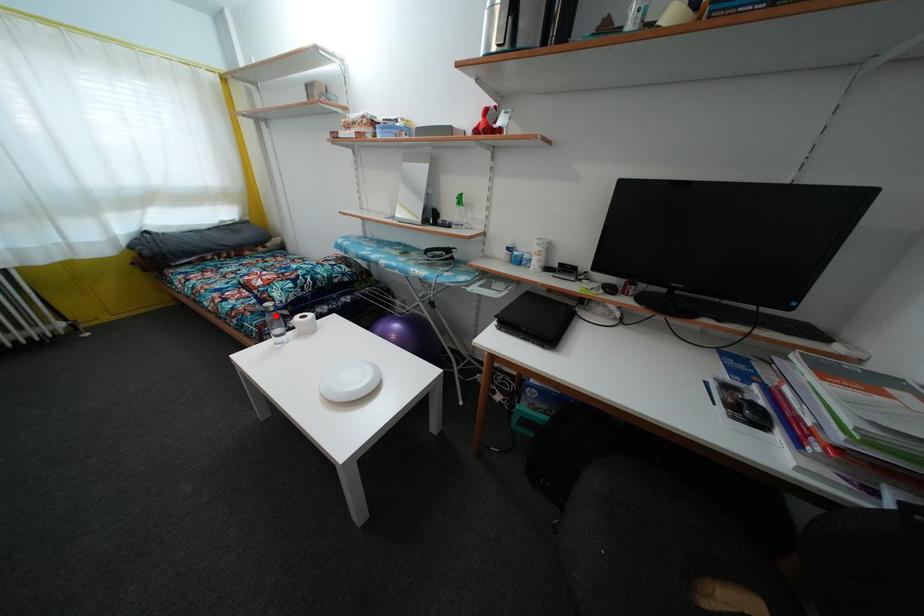
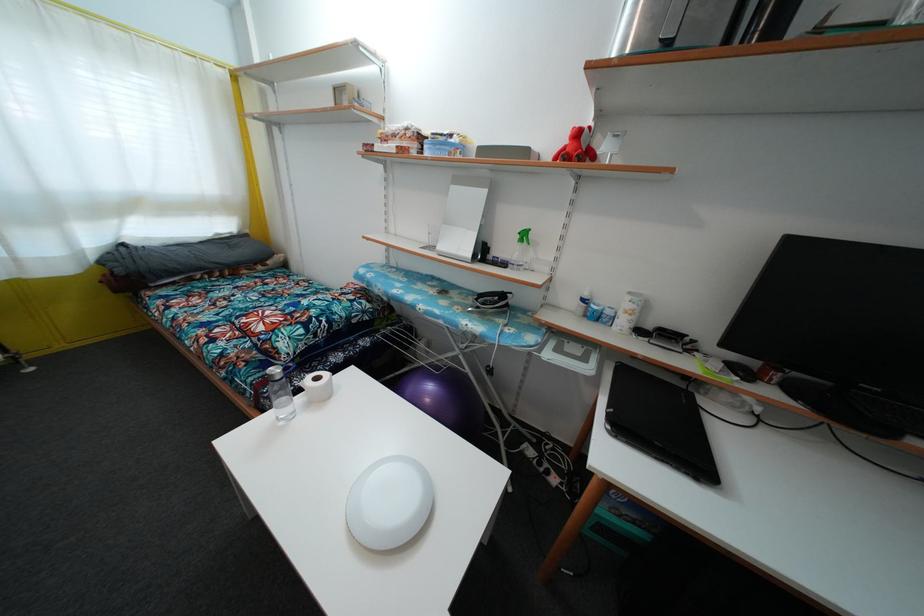
In the second image, find the point that corresponds to the highlighted location in the first image.

(282, 384)